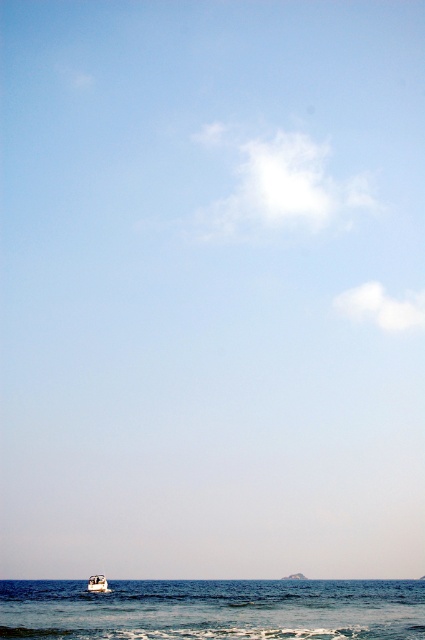
Is blue water at lower center closer to camera compared to white glossy boat at lower center?

Yes, blue water at lower center is in front of white glossy boat at lower center.

Between blue water at lower center and white glossy boat at lower center, which one has more height?

blue water at lower center

You are a GUI agent. You are given a task and a screenshot of the screen. Output one action in this format:
    pyautogui.click(x=<x>, y=<y>)
    Task: Click on the blue water at lower center
    This screenshot has width=425, height=640.
    Given the screenshot: What is the action you would take?
    pyautogui.click(x=214, y=609)

Where is `blue water at lower center`? Image resolution: width=425 pixels, height=640 pixels. blue water at lower center is located at coordinates (214, 609).